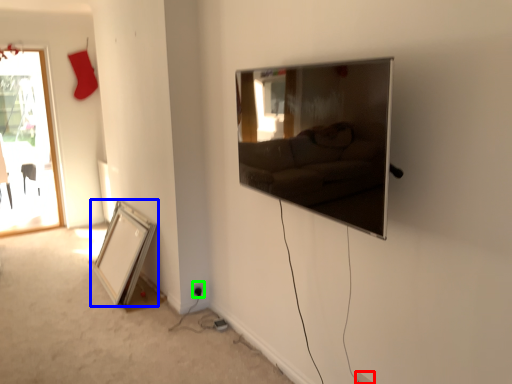
Question: Which object is the farthest from electric outlet (highlighted by a red box)? Choose among these: picture frame (highlighted by a blue box) or electric outlet (highlighted by a green box).

Choices:
 (A) picture frame
 (B) electric outlet

Answer: (A)